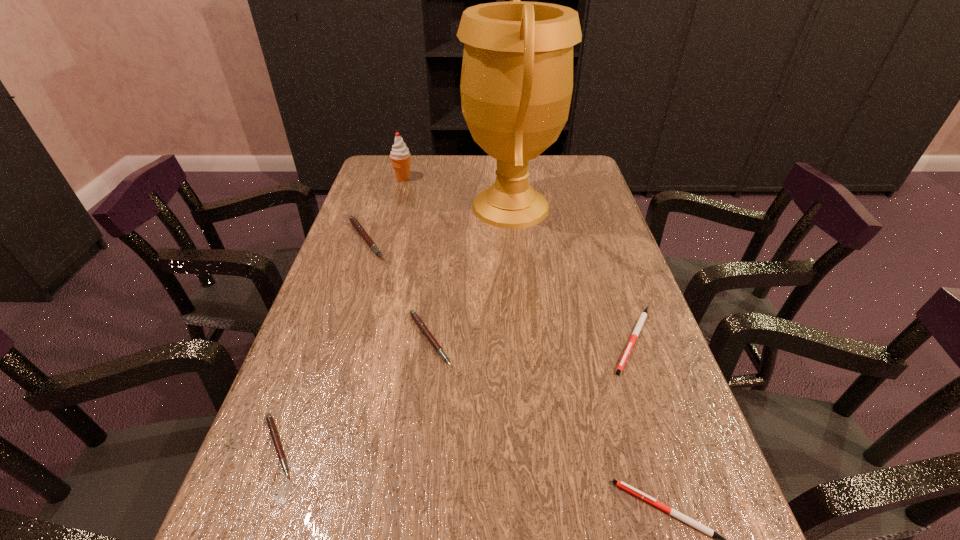
The height and width of the screenshot is (540, 960). In order to click on blank area located on the engravings side of the tallest object in this screenshot , I will do `click(371, 207)`.

Identify the location of free space located on the engravings side of the tallest object. The height and width of the screenshot is (540, 960). (396, 207).

Identify the location of free space located 0.200m on the engravings side of the tallest object. (x=396, y=207).

Identify the location of vacant space located on the front of the icecream. The height and width of the screenshot is (540, 960). (385, 246).

This screenshot has width=960, height=540. I want to click on vacant space situated at the nib of the tallest pen, so click(525, 239).

At what (x,y) coordinates should I click in order to perform the action: click on vacant space situated at the nib of the second smallest pink pen. Please return your answer as a coordinate pair (x, y). This screenshot has height=540, width=960. Looking at the image, I should click on (601, 339).

Find the location of a particular element. The height and width of the screenshot is (540, 960). blank area located 0.130m on the clicker of the bigger white pen is located at coordinates (666, 437).

Locate an element on the screen. The image size is (960, 540). vacant space situated at the nib of the sixth farthest object is located at coordinates (466, 446).

This screenshot has height=540, width=960. I want to click on trophy present at the far edge, so click(516, 86).

Where is `icecream that is positioned at the far edge`? icecream that is positioned at the far edge is located at coordinates (400, 156).